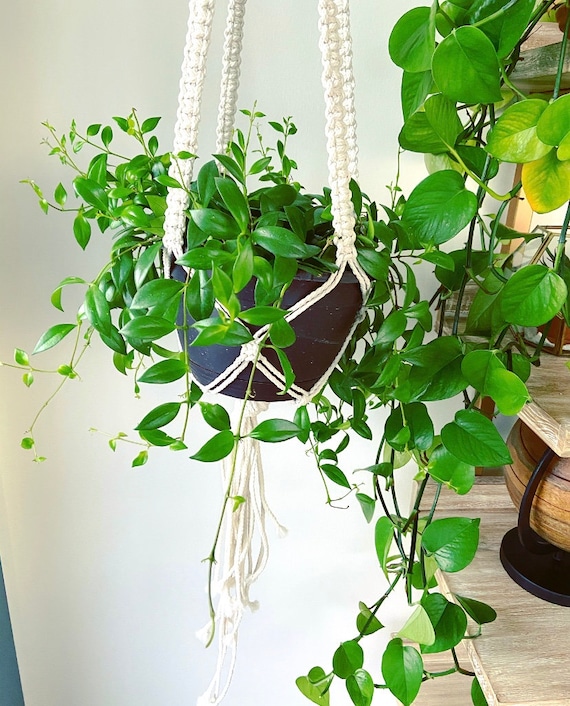
Identify the location of shelf. (535, 70), (551, 393), (525, 633), (443, 694).